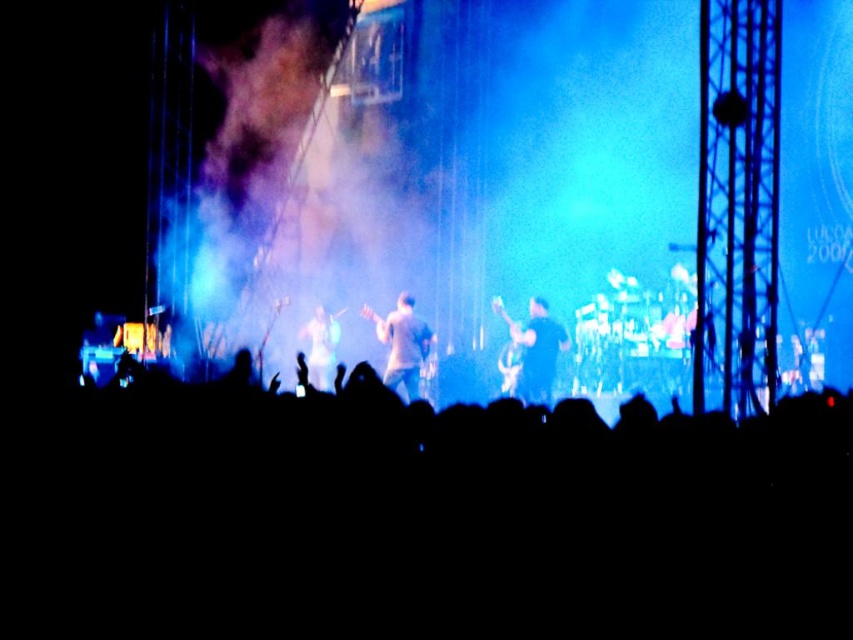
Question: In this image, where is black matte guitar at center located relative to shiny silver guitar at center?

Choices:
 (A) above
 (B) below

Answer: (A)

Question: Estimate the real-world distances between objects in this image. Which object is farther from the smoke at center?

Choices:
 (A) shiny silver guitar at center
 (B) black silhouettes at lower center
 (C) black matte guitar at center

Answer: (B)

Question: Which of these objects is positioned farthest from the smoke at center?

Choices:
 (A) light brown fabric shirt at center
 (B) black silhouettes at lower center
 (C) shiny silver guitar at center

Answer: (B)

Question: Which point is closer to the camera?

Choices:
 (A) smoke at center
 (B) shiny silver guitar at center

Answer: (A)

Question: Can you confirm if black silhouettes at lower center is smaller than smoke at center?

Choices:
 (A) yes
 (B) no

Answer: (A)

Question: Is black silhouettes at lower center in front of shiny silver guitar at center?

Choices:
 (A) no
 (B) yes

Answer: (B)